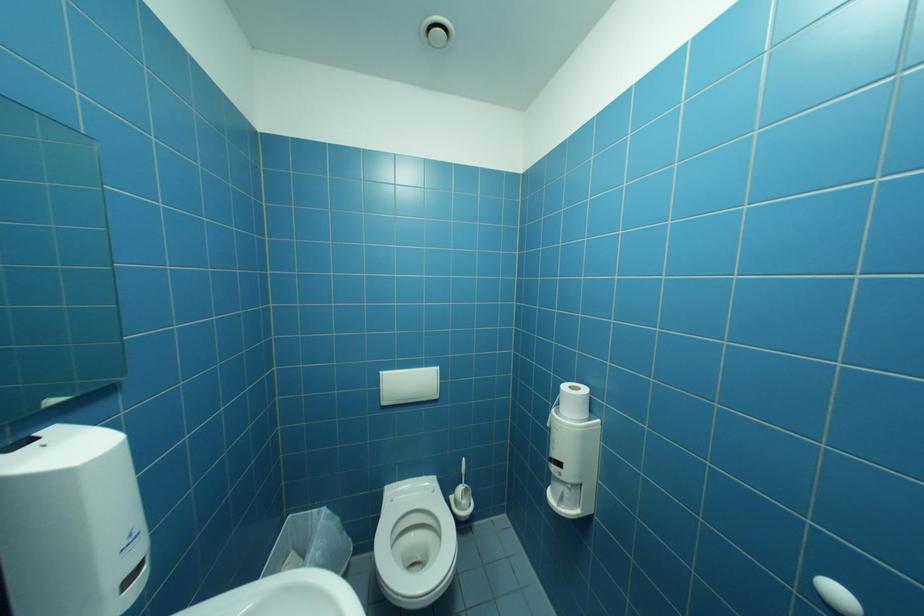
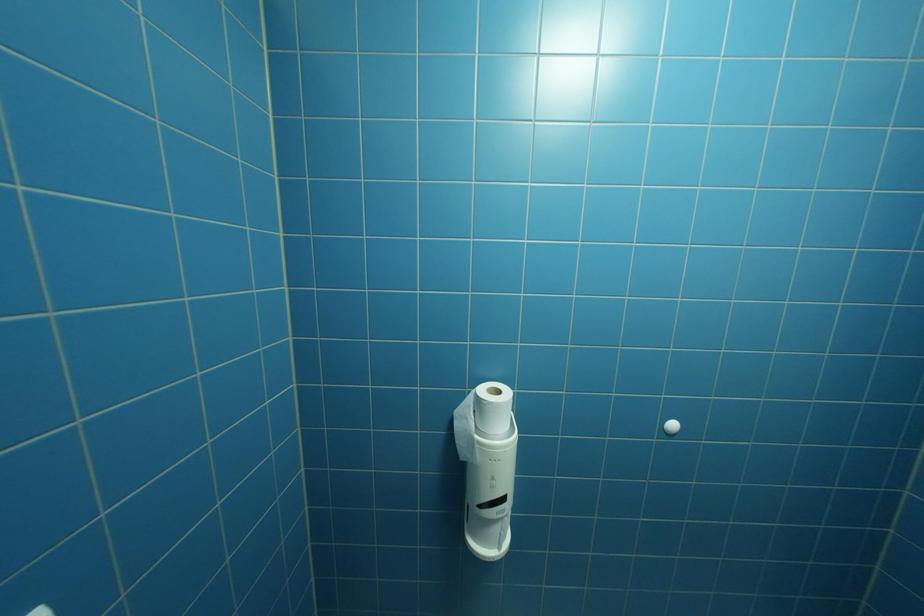
Question: The first image is from the beginning of the video and the second image is from the end. How did the camera likely rotate when shooting the video?

Choices:
 (A) Left
 (B) Right
 (C) Up
 (D) Down

Answer: (B)